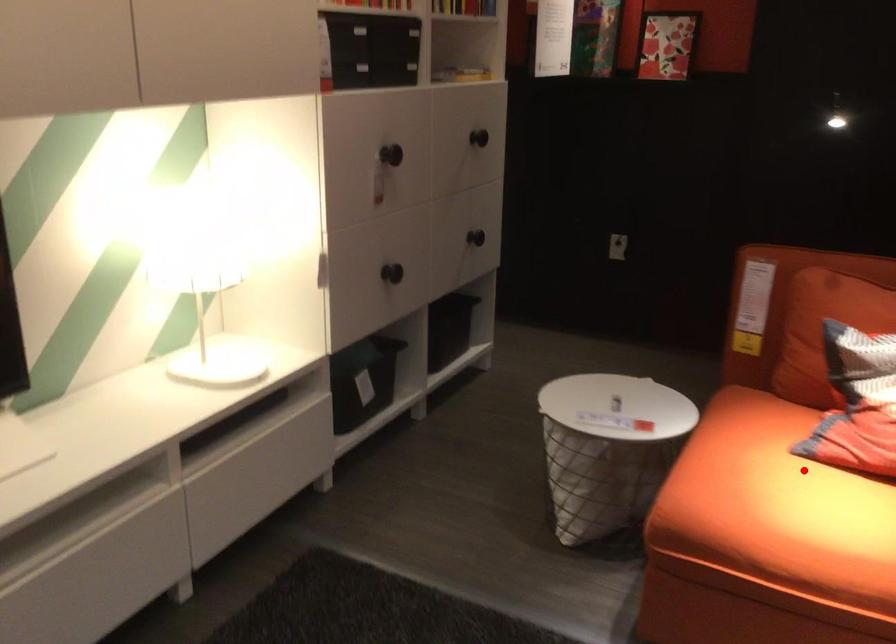
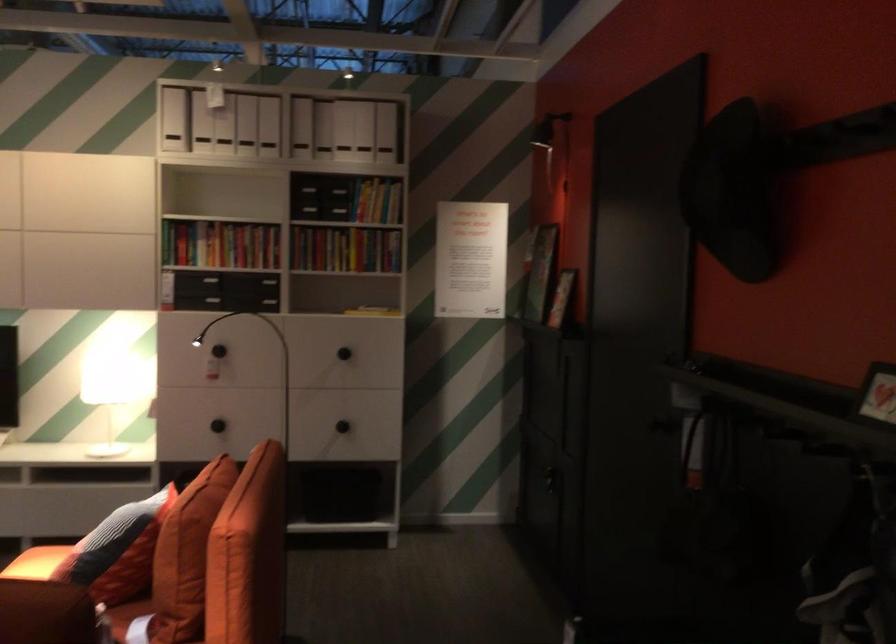
Question: I am providing you with two images of the same scene from different viewpoints. Image1 has a red point marked. In image2, the corresponding 3D location appears at what relative position? Reply with the corresponding letter.

Choices:
 (A) Closer
 (B) Farther

Answer: (B)